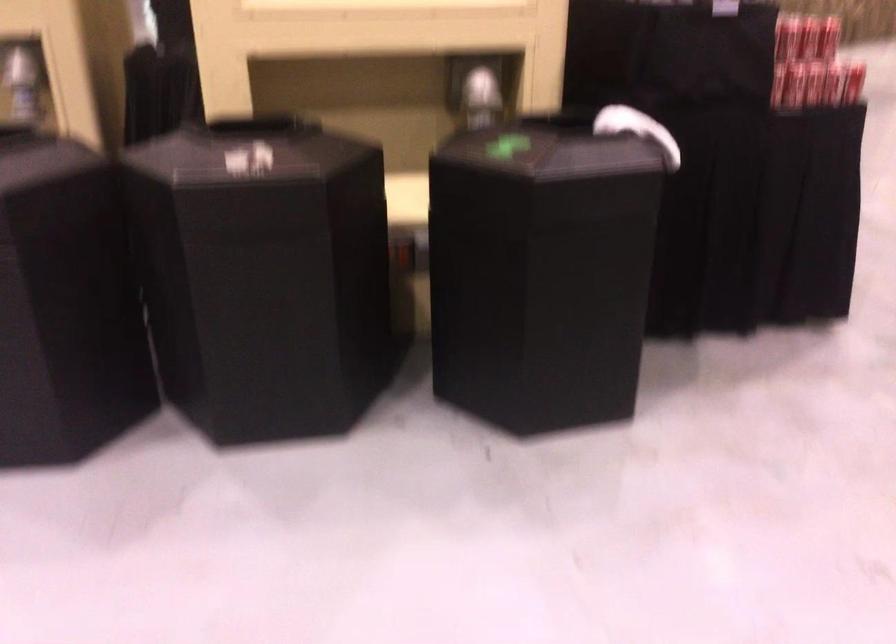
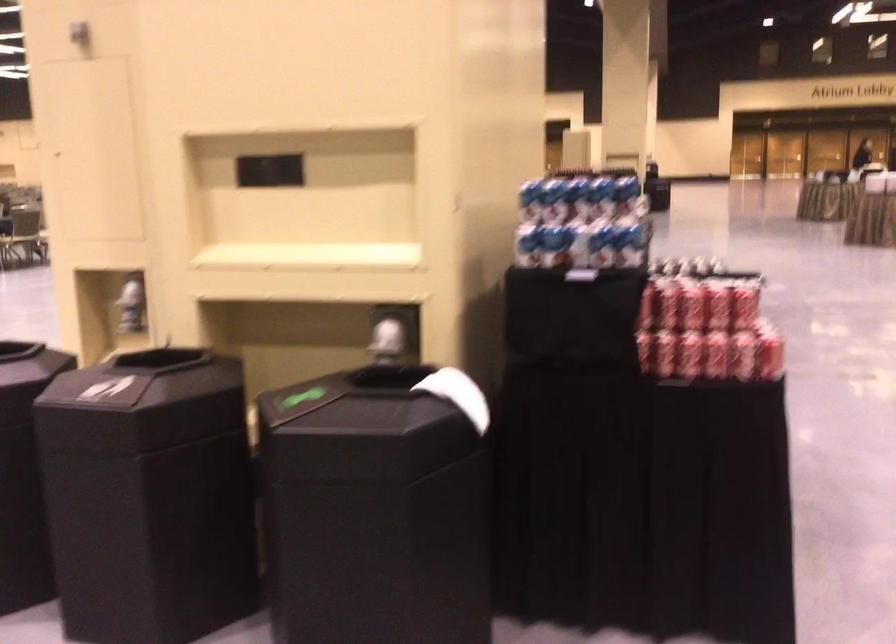
In the second image, find the point that corresponds to [784,80] in the first image.

(664, 353)